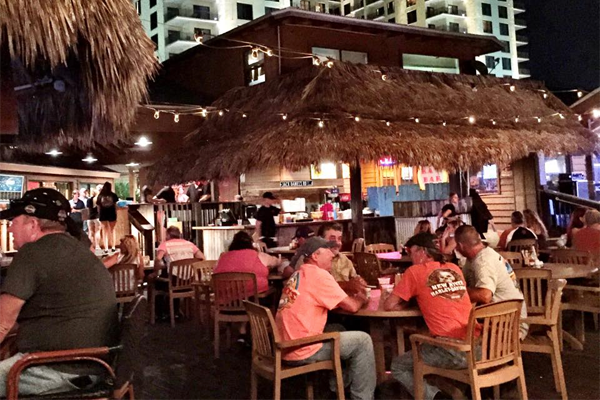
Find the location of `strings of lights`. strings of lights is located at coordinates (159, 109), (192, 31).